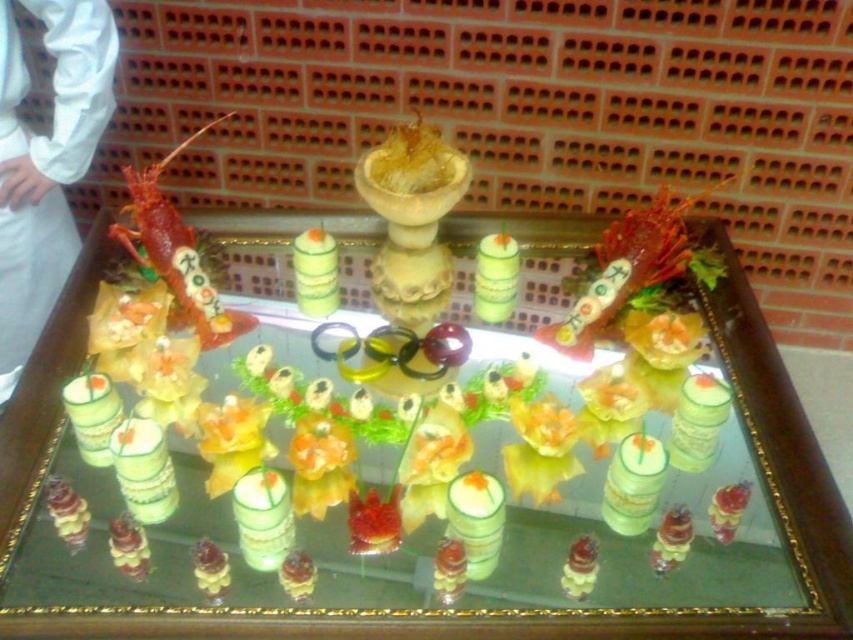
Is shiny red lobster at upper left to the left of golden shredded food at center from the viewer's perspective?

Yes, shiny red lobster at upper left is to the left of golden shredded food at center.

Is point (166, 257) positioned behind point (410, 132)?

Yes.

Is point (178, 225) farther from viewer compared to point (422, 131)?

Yes, it is.

Find the location of `shiny red lobster at upper left`. shiny red lobster at upper left is located at coordinates (172, 250).

Is green plastic tray at center thinner than shiny red lobster at upper left?

In fact, green plastic tray at center might be wider than shiny red lobster at upper left.

Who is lower down, green plastic tray at center or shiny red lobster at upper left?

green plastic tray at center is lower down.

Is point (106, 248) positioned in front of point (202, 314)?

No.

Where is `green plastic tray at center`? The image size is (853, 640). green plastic tray at center is located at coordinates (410, 456).

Is point (45, 237) positioned after point (367, 168)?

Yes, it is.

Between point (57, 180) and point (381, 177), which one is positioned behind?

The point (57, 180) is more distant.

Is point (56, 44) closer to viewer compared to point (421, 129)?

No, (56, 44) is behind (421, 129).

Locate an element on the screen. The height and width of the screenshot is (640, 853). white fabric at left is located at coordinates (45, 164).